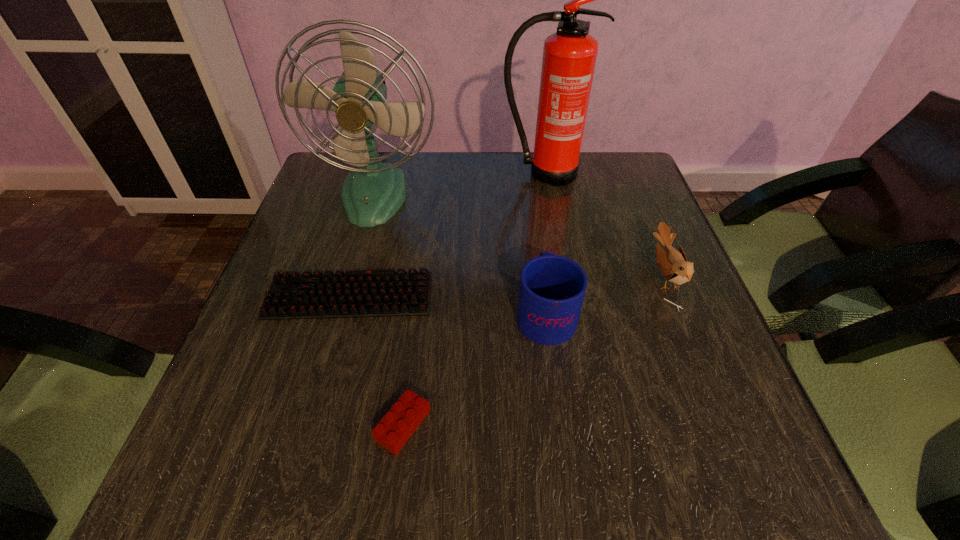
Locate an element on the screen. The height and width of the screenshot is (540, 960). object that is at the near edge is located at coordinates (396, 427).

You are a GUI agent. You are given a task and a screenshot of the screen. Output one action in this format:
    pyautogui.click(x=<x>, y=<y>)
    Task: Click on the fan situated at the left edge
    The height and width of the screenshot is (540, 960).
    Given the screenshot: What is the action you would take?
    pyautogui.click(x=371, y=194)

Where is `computer keyboard located at the left edge`? Image resolution: width=960 pixels, height=540 pixels. computer keyboard located at the left edge is located at coordinates pyautogui.click(x=356, y=293).

In order to click on fire extinguisher present at the right edge in this screenshot , I will do `click(569, 56)`.

You are a GUI agent. You are given a task and a screenshot of the screen. Output one action in this format:
    pyautogui.click(x=<x>, y=<y>)
    Task: Click on the bird at the right edge
    The height and width of the screenshot is (540, 960).
    Given the screenshot: What is the action you would take?
    672,264

The image size is (960, 540). I want to click on object that is at the far left corner, so click(x=371, y=194).

This screenshot has width=960, height=540. I want to click on object at the far right corner, so click(569, 56).

You are a GUI agent. You are given a task and a screenshot of the screen. Output one action in this format:
    pyautogui.click(x=<x>, y=<y>)
    Task: Click on the vacant space at the far edge of the desktop
    The width and height of the screenshot is (960, 540).
    Given the screenshot: What is the action you would take?
    pyautogui.click(x=511, y=156)

I want to click on free space at the near edge of the desktop, so click(x=609, y=455).

At what (x,y) coordinates should I click in order to perform the action: click on free space at the left edge of the desktop. Please return your answer as a coordinate pair (x, y). Image resolution: width=960 pixels, height=540 pixels. Looking at the image, I should click on (313, 335).